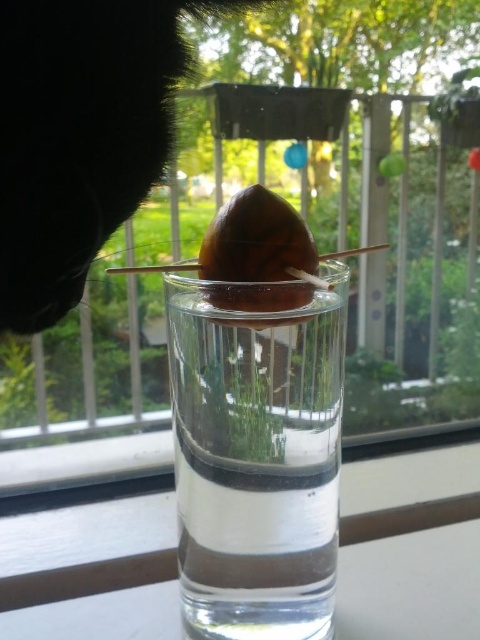
You are a photographer setting up a shot of the clear glass vase at center and the black fur cat at upper left. To avoid the cat blocking the vase, should you adjust the vase or the cat?

The clear glass vase at center is positioned under the black fur cat at upper left, so you should adjust the vase upward or the cat downward to prevent the cat from blocking the vase.

You are a squirrel trying to retrieve the brown matte acorn at center from the glass. There is a black fur cat at upper left nearby. What obstacle might you need to avoid?

The black fur cat at upper left is positioned over the brown matte acorn at center, so the squirrel should avoid the cat to safely retrieve the acorn.